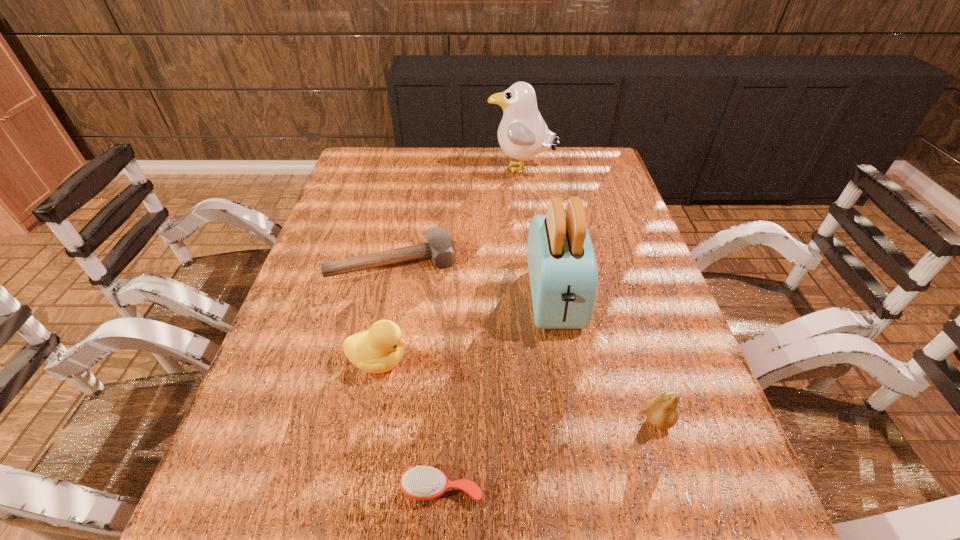
At what (x,y) coordinates should I click in order to perform the action: click on vacant space at the near edge of the desktop. Please return your answer as a coordinate pair (x, y). Looking at the image, I should click on (355, 531).

This screenshot has width=960, height=540. In the image, there is a desktop. Find the location of `free region at the left edge`. free region at the left edge is located at coordinates (323, 243).

Find the location of a particular element. The width and height of the screenshot is (960, 540). free spot at the right edge of the desktop is located at coordinates (680, 346).

This screenshot has height=540, width=960. What are the coordinates of `blank area at the far left corner` in the screenshot? It's located at (383, 175).

Where is `vacant space that's between the pear and the shortest object`? Image resolution: width=960 pixels, height=540 pixels. vacant space that's between the pear and the shortest object is located at coordinates (550, 454).

You are a GUI agent. You are given a task and a screenshot of the screen. Output one action in this format:
    pyautogui.click(x=<x>, y=<y>)
    Task: Click on the vacant space in between the farthest object and the mallet
    This screenshot has width=960, height=540.
    Given the screenshot: What is the action you would take?
    pyautogui.click(x=457, y=215)

Find the location of a particular element. This screenshot has height=540, width=960. vacant region between the mallet and the rightmost object is located at coordinates (525, 340).

Locate an element on the screen. Image resolution: width=960 pixels, height=540 pixels. empty space between the fourth farthest object and the rightmost object is located at coordinates 518,390.

Where is `vacant area between the second nearest object and the fourth farthest object`? vacant area between the second nearest object and the fourth farthest object is located at coordinates (518, 390).

Where is `empty space between the second shortest object and the farthest object`? empty space between the second shortest object and the farthest object is located at coordinates (457, 215).